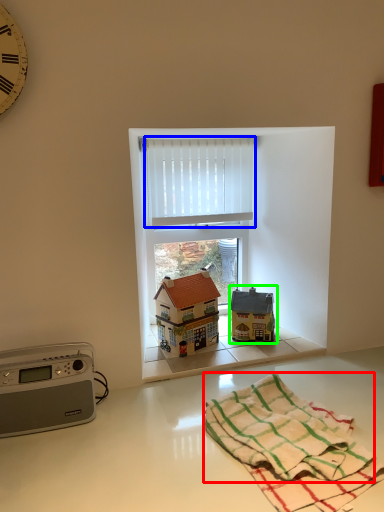
Question: Based on their relative distances, which object is farther from bath towel (highlighted by a red box)? Choose from curtain (highlighted by a blue box) and toy (highlighted by a green box).

Choices:
 (A) curtain
 (B) toy

Answer: (A)